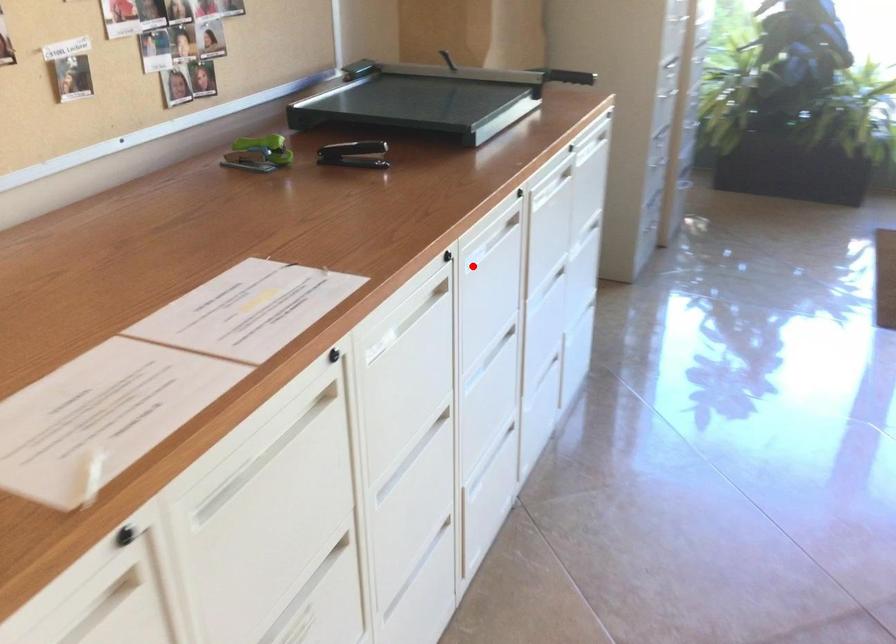
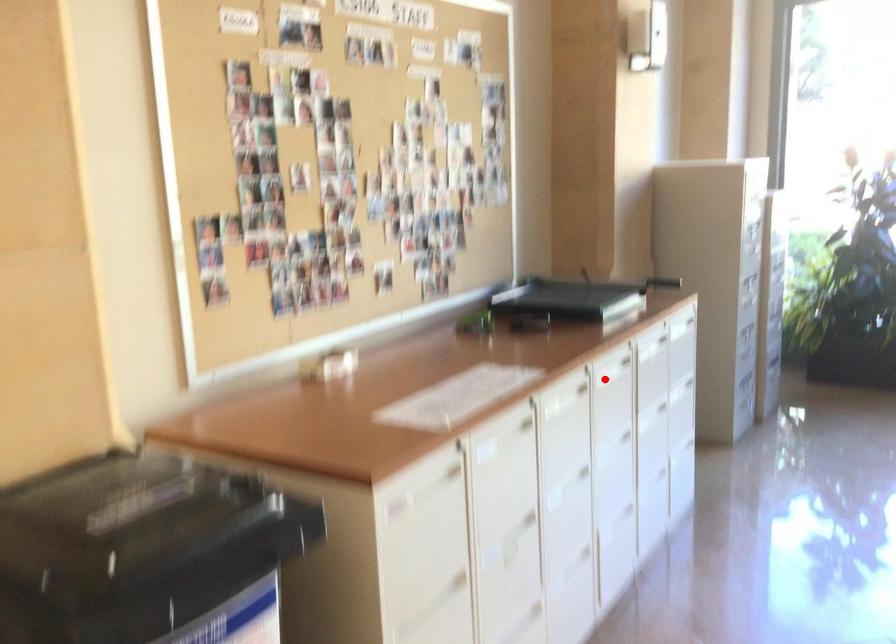
I am providing you with two images of the same scene from different viewpoints. A red point is marked on the first image and another point is marked on the second image. Does the point marked in image1 correspond to the same location as the one in image2?

Yes